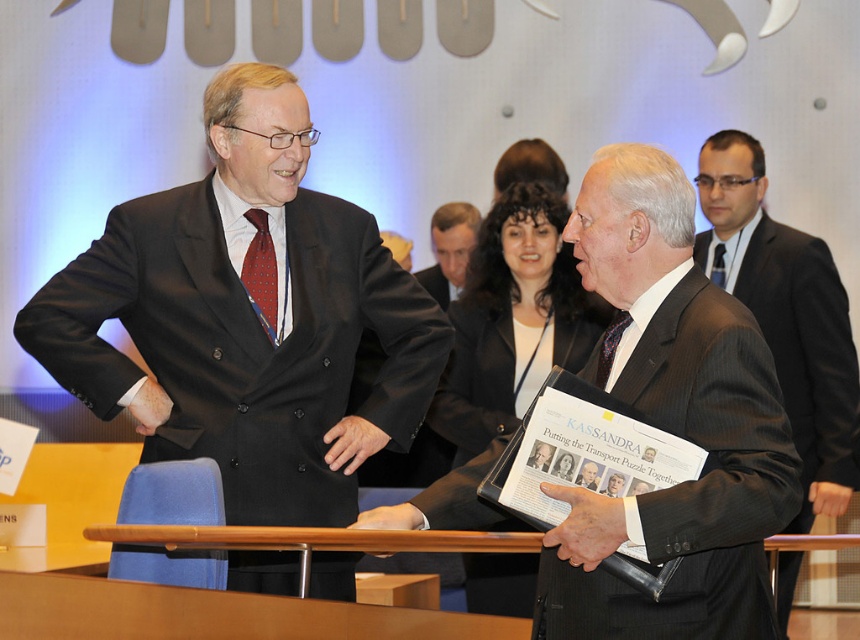
Question: Among these points, which one is farthest from the camera?

Choices:
 (A) coord(619,513)
 (B) coord(716,250)
 (C) coord(422,522)

Answer: (B)

Question: Can you confirm if dark gray textured suit at center is bigger than black wool suit at center?

Choices:
 (A) no
 (B) yes

Answer: (B)

Question: Can you confirm if smooth skin hand at center is wider than black wool suit at center?

Choices:
 (A) yes
 (B) no

Answer: (B)

Question: Which is farther from the black leather hand at center?

Choices:
 (A) black suit at left
 (B) dark blue textured tie at center
 (C) black suit at upper right
 (D) matte black suit at center

Answer: (C)

Question: Which point is closer to the camera taking this photo?

Choices:
 (A) (349, 465)
 (B) (434, 276)

Answer: (A)

Question: Considering the relative positions of dark gray textured suit at center and matte black suit at center in the image provided, where is dark gray textured suit at center located with respect to matte black suit at center?

Choices:
 (A) above
 (B) below

Answer: (B)